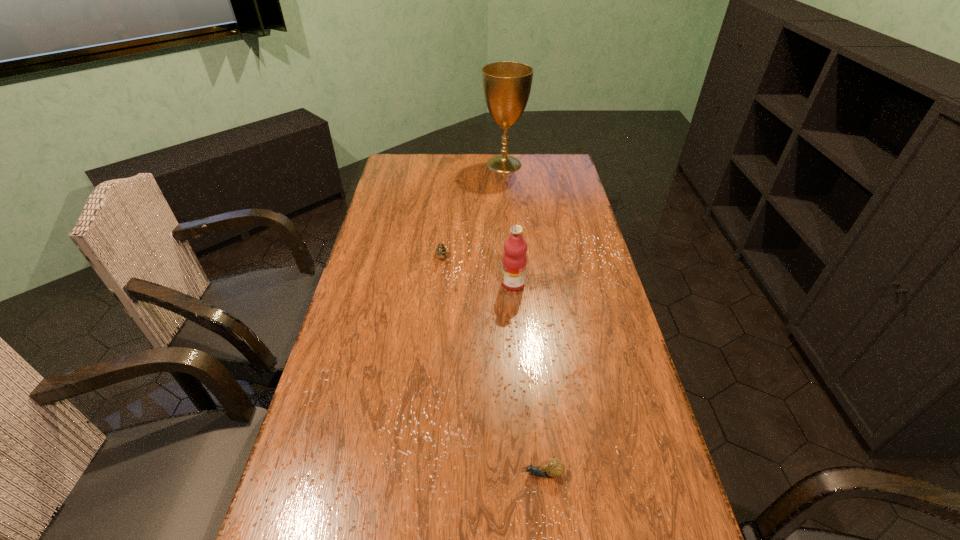
Choose which object is the third nearest neighbor to the farthest object. Please provide its 2D coordinates. Your answer should be formatted as a tuple, i.e. [(x, y)], where the tuple contains the x and y coordinates of a point satisfying the conditions above.

[(554, 468)]

Locate which object is the closest to the farthest object. Please provide its 2D coordinates. Your answer should be formatted as a tuple, i.e. [(x, y)], where the tuple contains the x and y coordinates of a point satisfying the conditions above.

[(441, 250)]

Locate which escargot ranks in proximity to the second tallest object. Please provide its 2D coordinates. Your answer should be formatted as a tuple, i.e. [(x, y)], where the tuple contains the x and y coordinates of a point satisfying the conditions above.

[(441, 250)]